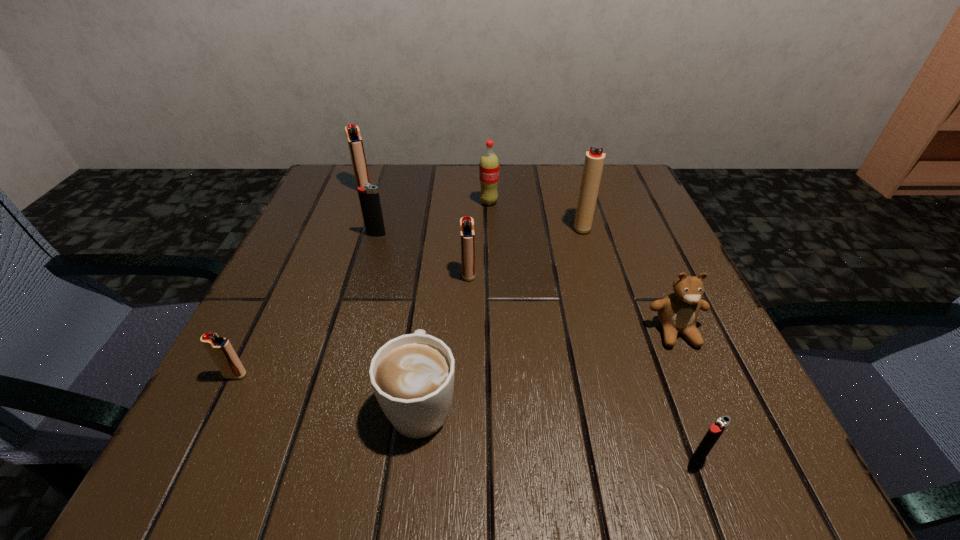
Locate an element on the screen. Image resolution: width=960 pixels, height=540 pixels. empty space that is in between the tallest igniter and the fourth object from right to left is located at coordinates (536, 214).

I want to click on blank region between the second red igniter from left to right and the teddy bear, so click(x=520, y=260).

At what (x,y) coordinates should I click in order to perform the action: click on blank region between the smaller black igniter and the white cappuccino. Please return your answer as a coordinate pair (x, y). Looking at the image, I should click on (559, 430).

In order to click on vacant area that lies between the teddy bear and the cappuccino in this screenshot , I will do click(x=548, y=367).

You are a GUI agent. You are given a task and a screenshot of the screen. Output one action in this format:
    pyautogui.click(x=<x>, y=<y>)
    Task: Click on the vacant area that lies between the third farthest red igniter and the soda
    Image resolution: width=960 pixels, height=540 pixels.
    Given the screenshot: What is the action you would take?
    pyautogui.click(x=478, y=238)

Locate an element on the screen. This screenshot has width=960, height=540. free spot between the white cappuccino and the rightmost red igniter is located at coordinates 502,314.

Where is `unoccupied position between the third igniter from right to left and the fifth igniter from left to right`? unoccupied position between the third igniter from right to left and the fifth igniter from left to right is located at coordinates (525, 250).

This screenshot has width=960, height=540. I want to click on vacant area that lies between the second farthest object and the left black igniter, so click(x=433, y=219).

The height and width of the screenshot is (540, 960). Find the location of `free area in between the fourth farthest igniter and the fifth shortest igniter`. free area in between the fourth farthest igniter and the fifth shortest igniter is located at coordinates (416, 231).

Identify the location of vacant space that's between the white cappuccino and the farthest object. The height and width of the screenshot is (540, 960). (393, 295).